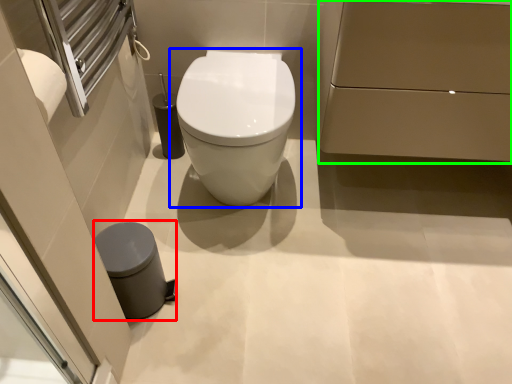
Question: Considering the real-world distances, which object is closest to porcelain (highlighted by a red box)? toilet (highlighted by a blue box) or porcelain (highlighted by a green box).

Choices:
 (A) toilet
 (B) porcelain

Answer: (A)